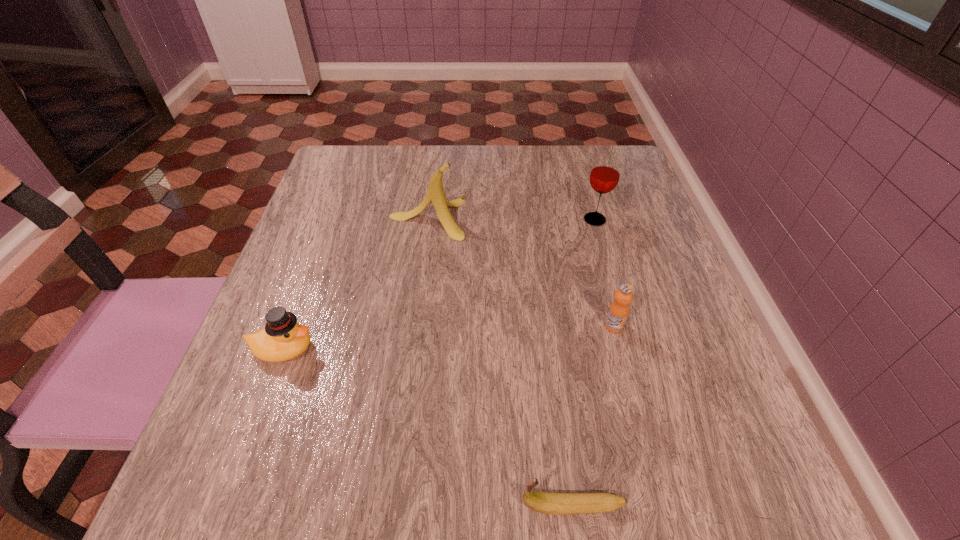
In order to click on glass in this screenshot , I will do `click(605, 173)`.

Find the location of a particular element. The height and width of the screenshot is (540, 960). the left banana is located at coordinates (435, 194).

Find the location of a particular element. the taller banana is located at coordinates (435, 194).

Locate an element on the screen. The height and width of the screenshot is (540, 960). orange juice is located at coordinates (619, 309).

I want to click on the leftmost object, so (283, 338).

The width and height of the screenshot is (960, 540). Identify the location of the third object from right to left. [x=551, y=503].

This screenshot has height=540, width=960. I want to click on the shorter banana, so click(x=551, y=503).

Locate an element on the screen. The width and height of the screenshot is (960, 540). free space located on the back of the glass is located at coordinates (574, 148).

Where is `vacant space located on the left of the left banana`? The image size is (960, 540). vacant space located on the left of the left banana is located at coordinates [x=367, y=218].

The height and width of the screenshot is (540, 960). Identify the location of vacant region located 0.280m on the front label of the orange juice. pyautogui.click(x=661, y=505).